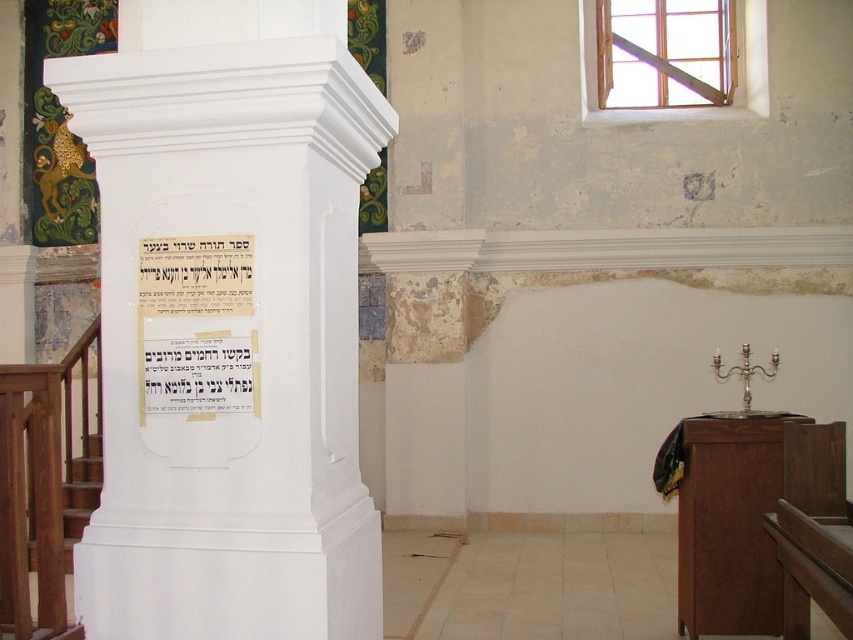
Can you confirm if matte paper scroll at center is thinner than brown wooden stairs at lower left?

Indeed, matte paper scroll at center has a lesser width compared to brown wooden stairs at lower left.

Identify the location of matte paper scroll at center. The image size is (853, 640). (196, 326).

Is white smooth pillar at center smaller than matte paper scroll at center?

No, white smooth pillar at center is not smaller than matte paper scroll at center.

Is white smooth pillar at center closer to camera compared to matte paper scroll at center?

That is True.

The image size is (853, 640). Describe the element at coordinates (229, 340) in the screenshot. I see `white smooth pillar at center` at that location.

Identify the location of white smooth pillar at center. The width and height of the screenshot is (853, 640). (229, 340).

Between white smooth pillar at center and brown wooden stairs at lower left, which one is positioned higher?

white smooth pillar at center is higher up.

The width and height of the screenshot is (853, 640). I want to click on white smooth pillar at center, so click(229, 340).

This screenshot has width=853, height=640. I want to click on white smooth pillar at center, so click(x=229, y=340).